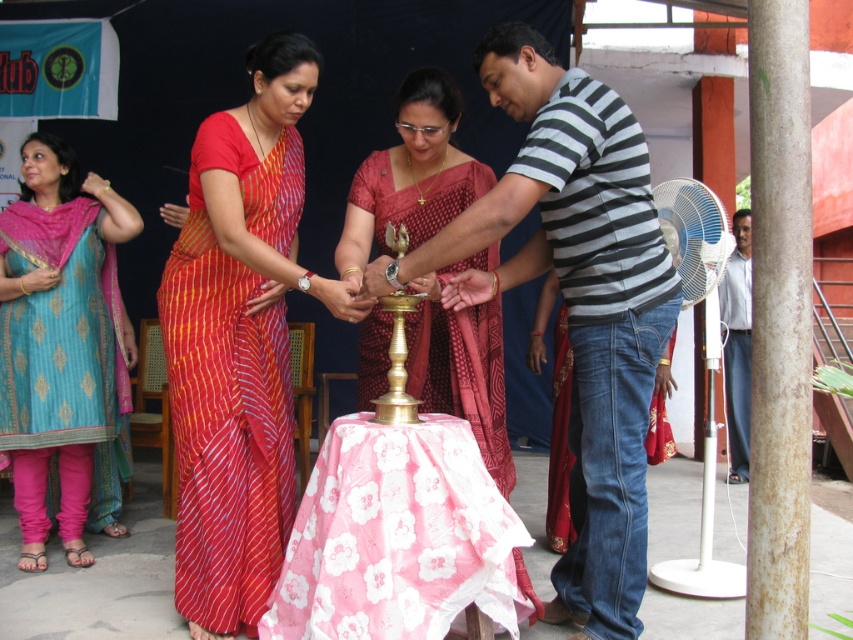
Is red striped saree at center bigger than pink floral fabric at center?

Yes.

Where is `red striped saree at center`? The image size is (853, 640). red striped saree at center is located at coordinates (239, 340).

Who is positioned more to the left, teal silk kurta with pink pants at left or white shirt at right?

teal silk kurta with pink pants at left

What do you see at coordinates (59, 339) in the screenshot? Image resolution: width=853 pixels, height=640 pixels. I see `teal silk kurta with pink pants at left` at bounding box center [59, 339].

The height and width of the screenshot is (640, 853). What are the coordinates of `teal silk kurta with pink pants at left` in the screenshot? It's located at (59, 339).

Identify the location of striped cotton shirt at center. The image size is (853, 640). (575, 300).

Does point (532, 128) come farther from viewer compared to point (212, 524)?

No, (532, 128) is in front of (212, 524).

Find the location of `striped cotton shirt at center`. striped cotton shirt at center is located at coordinates (575, 300).